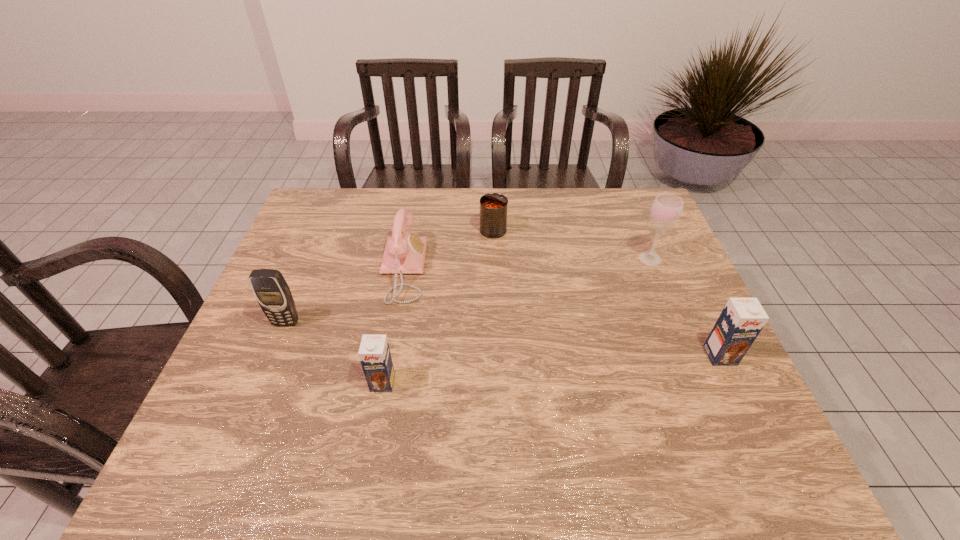
In the image, there is a desktop. Identify the location of vacant space at the near edge. (406, 394).

The width and height of the screenshot is (960, 540). I want to click on vacant region at the left edge of the desktop, so click(x=296, y=238).

This screenshot has width=960, height=540. I want to click on vacant space at the right edge, so click(x=668, y=277).

The height and width of the screenshot is (540, 960). What are the coordinates of `vacant region at the far left corner of the desktop` in the screenshot? It's located at (326, 193).

Where is `vacant space at the far right corner`? The width and height of the screenshot is (960, 540). vacant space at the far right corner is located at coordinates (639, 224).

The height and width of the screenshot is (540, 960). What are the coordinates of `free space between the fourth object from left to right and the fifth farthest object` in the screenshot? It's located at (607, 293).

Locate an element on the screen. free area in between the nearest object and the telephone is located at coordinates (393, 326).

The width and height of the screenshot is (960, 540). What are the coordinates of `vacant region between the second nearest object and the nearest object` in the screenshot? It's located at (551, 369).

The image size is (960, 540). I want to click on unoccupied position between the nearest object and the leftmost object, so click(x=334, y=353).

The width and height of the screenshot is (960, 540). What are the coordinates of `vacant space in between the telephone and the fifth object from left to right` in the screenshot? It's located at (526, 264).